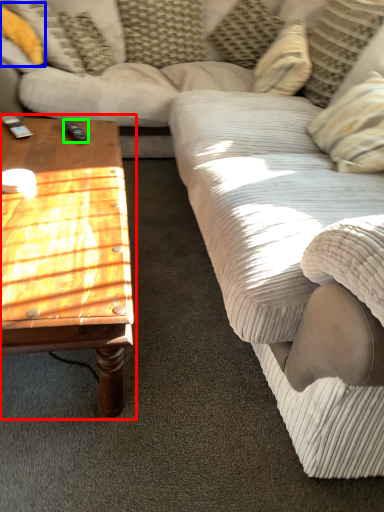
Question: Which object is the closest to the coffee table (highlighted by a red box)? Choose among these: pillow (highlighted by a blue box) or remote (highlighted by a green box).

Choices:
 (A) pillow
 (B) remote

Answer: (B)